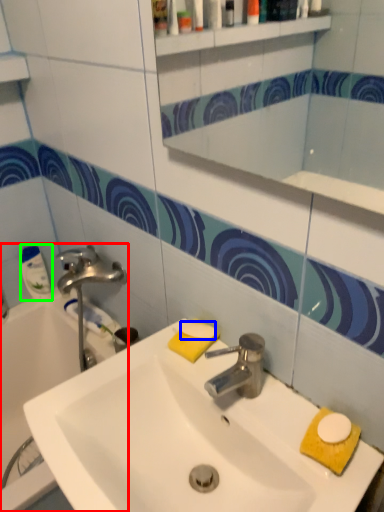
Question: Which is nearer to the bathtub (highlighted by a red box)? soap (highlighted by a blue box) or cleaning product (highlighted by a green box).

Choices:
 (A) soap
 (B) cleaning product

Answer: (B)